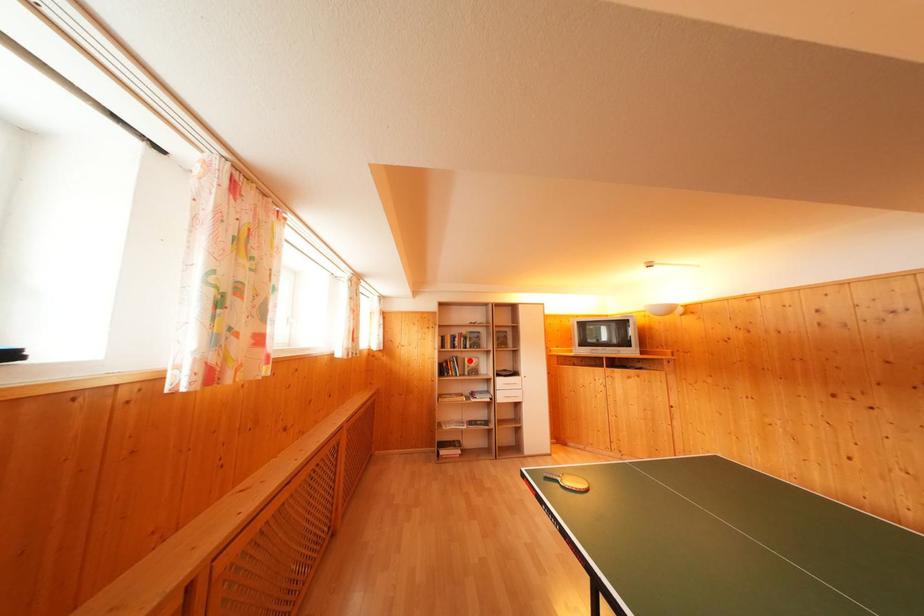
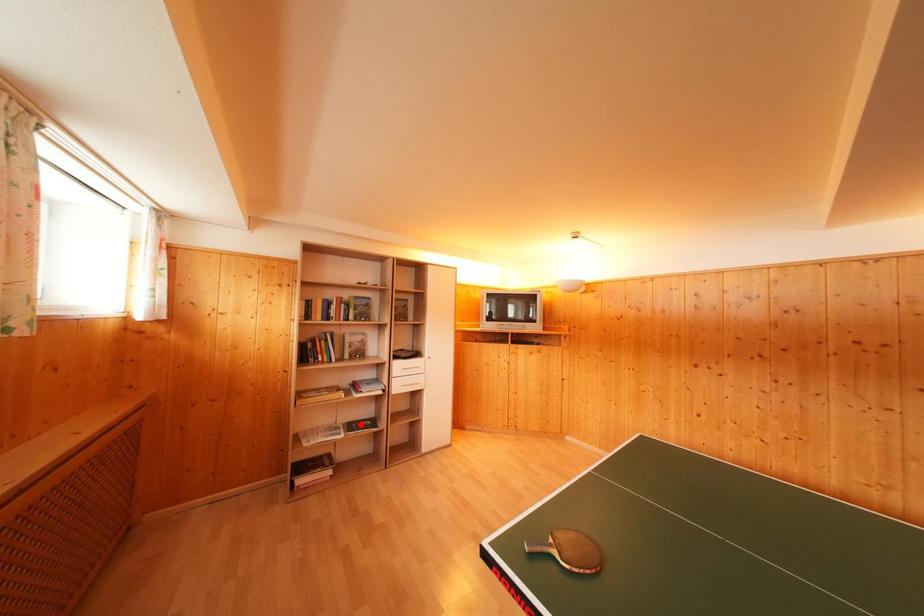
I am providing you with two images of the same scene from different viewpoints. A red point is marked on the first image and another point is marked on the second image. Do the highlighted points in image1 and image2 indicate the same real-world spot?

No